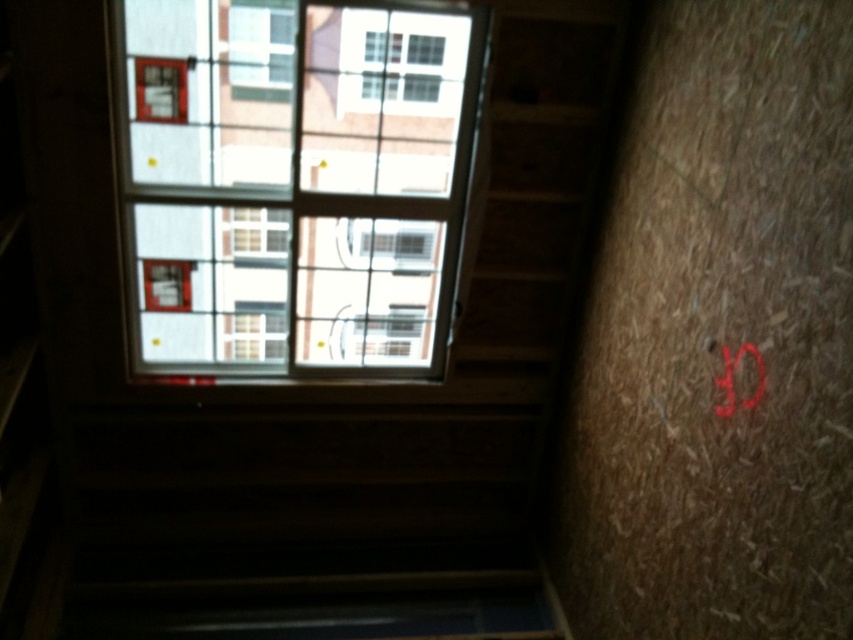
You are an interior designer assessing the space. You need to determine the placement of a new decorative shelf. The shelf must be placed below the clear glass window at upper center. Where should you position it in relation to the red matte lettering at upper right?

The clear glass window at upper center is located above the red matte lettering at upper right, so the decorative shelf should be placed below the window, which would place it at the same level as or below the red matte lettering at upper right.

You are a contractor measuring the space between two windows in a construction site. You see a transparent glass window at upper center and a clear glass window at upper center. Can you fit a 12 inch wide decorative panel between them?

The distance between the transparent glass window at upper center and the clear glass window at upper center is 10.09 inches. Since the decorative panel is 12 inches wide, it cannot fit in the space between them.

You are an inspector checking the construction site. You notice the red matte lettering at upper right and the transparent glass window at upper center. Which object is closer to you from your current position?

The transparent glass window at upper center is closer to you because the red matte lettering at upper right is behind it.